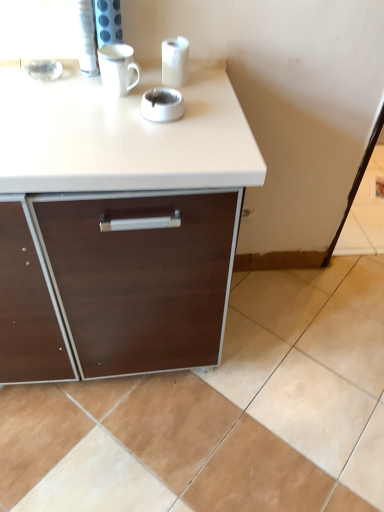
Question: Is white glossy ashtray at center directly adjacent to white glossy mug at upper center?

Choices:
 (A) yes
 (B) no

Answer: (B)

Question: From the image's perspective, is white glossy ashtray at center below white glossy mug at upper center?

Choices:
 (A) no
 (B) yes

Answer: (B)

Question: Is white glossy mug at upper center surrounded by white glossy ashtray at center?

Choices:
 (A) yes
 (B) no

Answer: (B)

Question: Considering the relative sizes of white glossy ashtray at center and white glossy mug at upper center in the image provided, is white glossy ashtray at center wider than white glossy mug at upper center?

Choices:
 (A) no
 (B) yes

Answer: (A)

Question: Can you confirm if white glossy ashtray at center is shorter than white glossy mug at upper center?

Choices:
 (A) yes
 (B) no

Answer: (A)

Question: From the image's perspective, relative to white glossy mug at upper center, is white glossy ashtray at center above or below?

Choices:
 (A) above
 (B) below

Answer: (B)

Question: Is white glossy ashtray at center taller or shorter than white glossy mug at upper center?

Choices:
 (A) tall
 (B) short

Answer: (B)

Question: Considering the positions of white glossy ashtray at center and white glossy mug at upper center in the image, is white glossy ashtray at center wider or thinner than white glossy mug at upper center?

Choices:
 (A) thin
 (B) wide

Answer: (A)

Question: Would you say white glossy ashtray at center is to the left or to the right of white glossy mug at upper center in the picture?

Choices:
 (A) right
 (B) left

Answer: (A)

Question: Is beige ceramic tile at lower right situated inside white glossy mug at upper center or outside?

Choices:
 (A) inside
 (B) outside

Answer: (B)

Question: In terms of width, does beige ceramic tile at lower right look wider or thinner when compared to white glossy mug at upper center?

Choices:
 (A) thin
 (B) wide

Answer: (B)

Question: Considering the positions of point 309,365 and point 127,71, is point 309,365 closer or farther from the camera than point 127,71?

Choices:
 (A) closer
 (B) farther

Answer: (B)

Question: Relative to white glossy mug at upper center, is beige ceramic tile at lower right in front or behind?

Choices:
 (A) front
 (B) behind

Answer: (B)

Question: From a real-world perspective, is beige ceramic tile at lower right physically located above or below white glossy ashtray at center?

Choices:
 (A) above
 (B) below

Answer: (B)

Question: From the image's perspective, relative to white glossy ashtray at center, is beige ceramic tile at lower right above or below?

Choices:
 (A) above
 (B) below

Answer: (B)